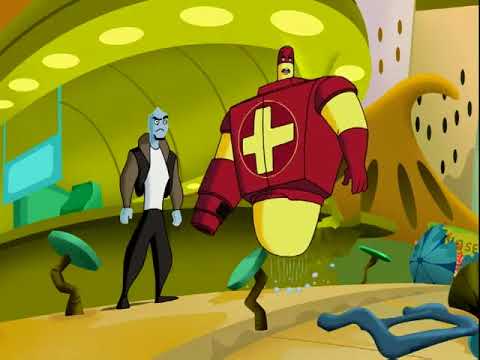
The width and height of the screenshot is (480, 360). Find the location of `screen`. screen is located at coordinates (37, 173).